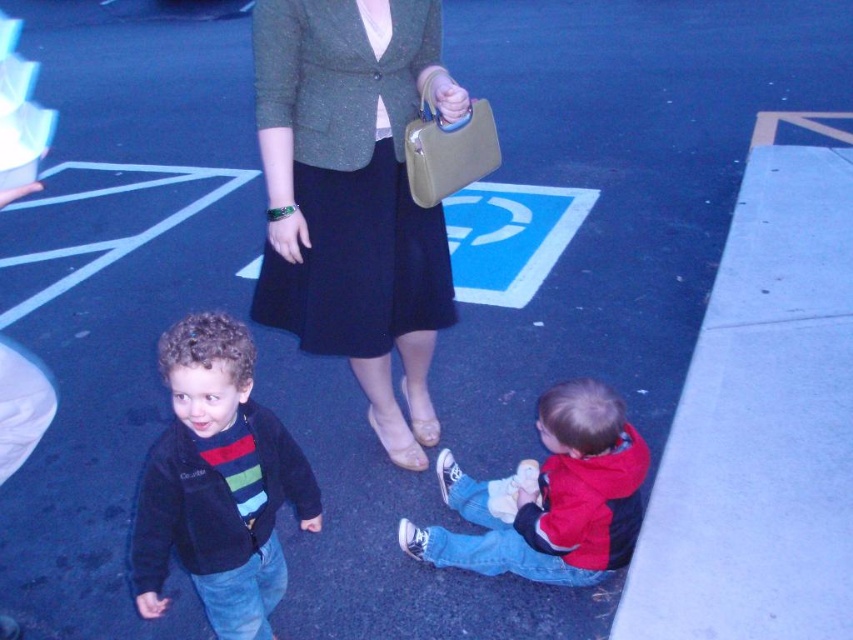
Is green textured blazer at center positioned behind red fleece jacket at lower right?

Yes, green textured blazer at center is behind red fleece jacket at lower right.

The width and height of the screenshot is (853, 640). Identify the location of green textured blazer at center. click(354, 196).

Is green textured blazer at center to the left of dark blue fleece jacket at center from the viewer's perspective?

No, green textured blazer at center is not to the left of dark blue fleece jacket at center.

Is point (339, 193) more distant than point (219, 330)?

Yes, it is behind point (219, 330).

Which is in front, point (380, 52) or point (216, 384)?

Positioned in front is point (216, 384).

The image size is (853, 640). Identify the location of green textured blazer at center. (354, 196).

Can you confirm if dark blue fleece jacket at center is wider than red fleece jacket at lower right?

In fact, dark blue fleece jacket at center might be narrower than red fleece jacket at lower right.

Is dark blue fleece jacket at center above red fleece jacket at lower right?

Correct, dark blue fleece jacket at center is located above red fleece jacket at lower right.

Identify the location of dark blue fleece jacket at center. (218, 483).